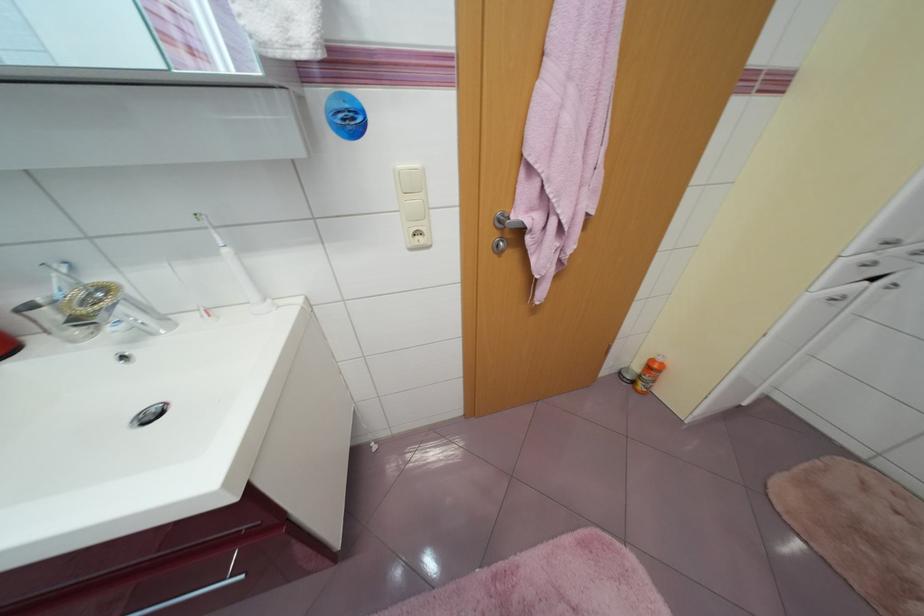
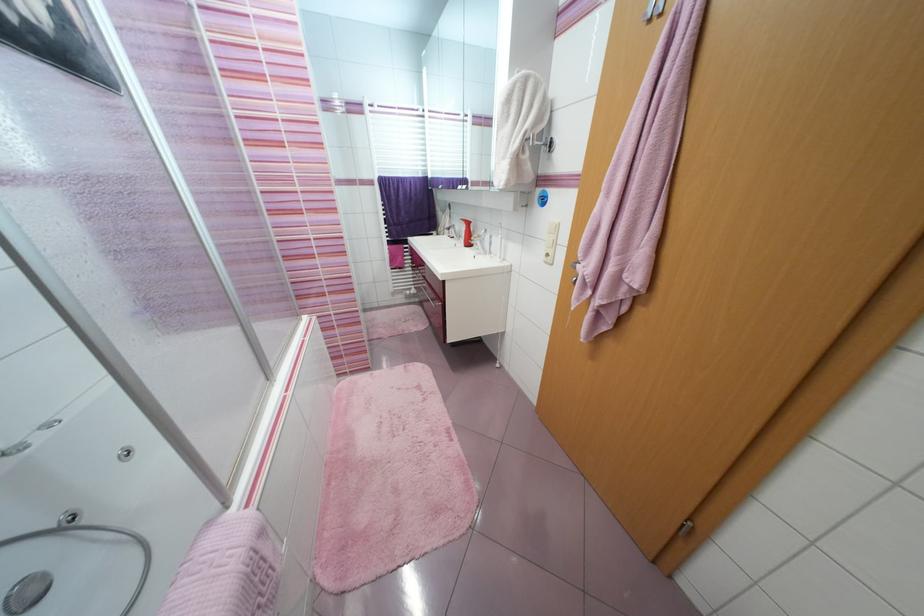
Locate, in the second image, the point that corresponds to (x=417, y=251) in the first image.

(551, 264)